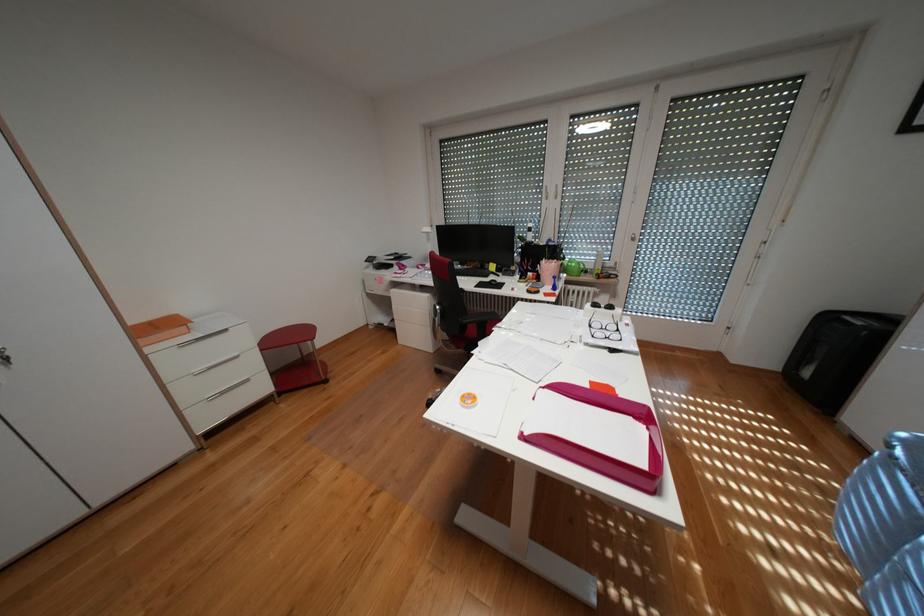
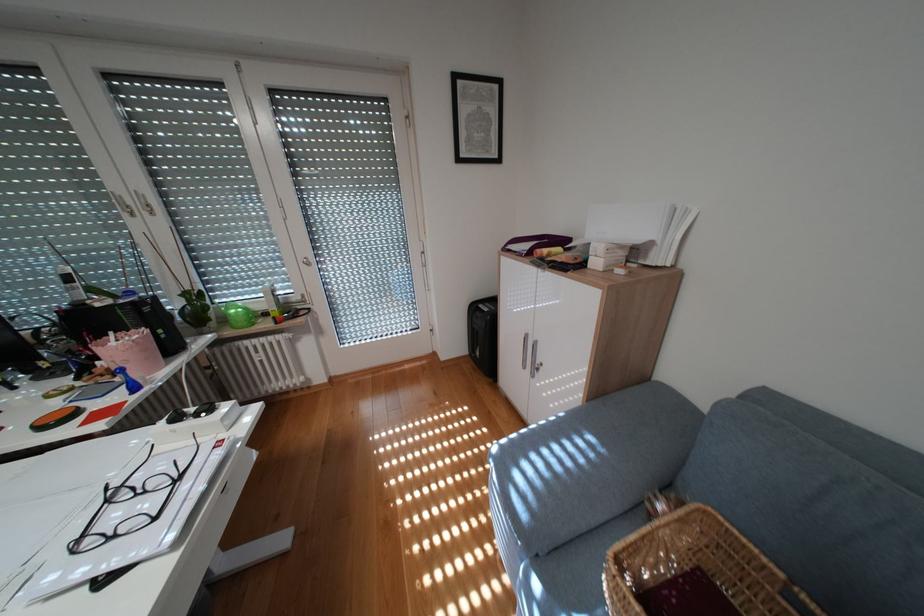
Find the pixel in the second image that matches pixel 561 190 in the first image.

(141, 201)